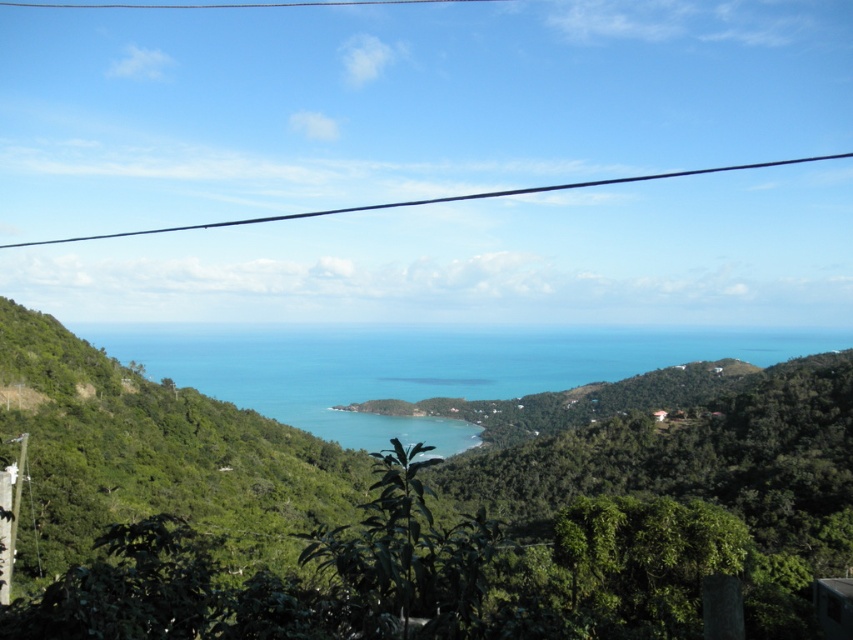
You are a bird flying over the coastal landscape in the image. You notice the blue water at center and the black wire at upper center. Which of these two objects would appear larger to you from your vantage point?

The blue water at center appears larger than the black wire at upper center, so it would look bigger from the bird s vantage point.